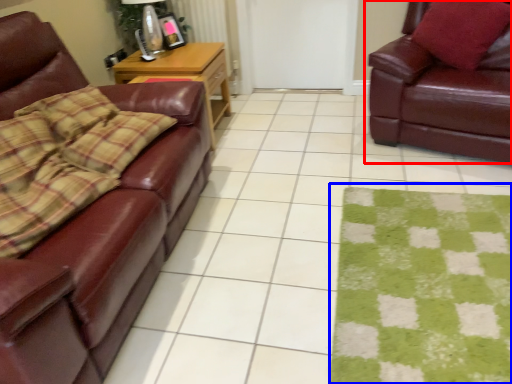
Question: Which of the following is the farthest to the observer, studio couch (highlighted by a red box) or mat (highlighted by a blue box)?

Choices:
 (A) studio couch
 (B) mat

Answer: (A)